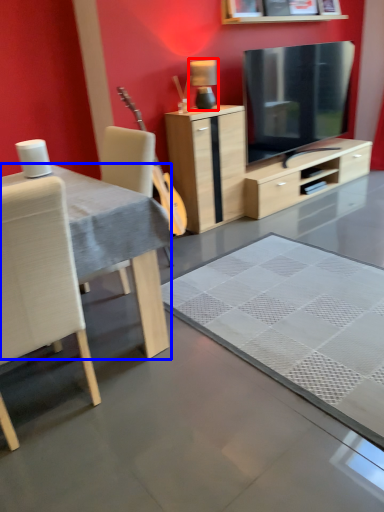
Question: Among these objects, which one is nearest to the camera, lamp (highlighted by a red box) or desk (highlighted by a blue box)?

Choices:
 (A) lamp
 (B) desk

Answer: (B)